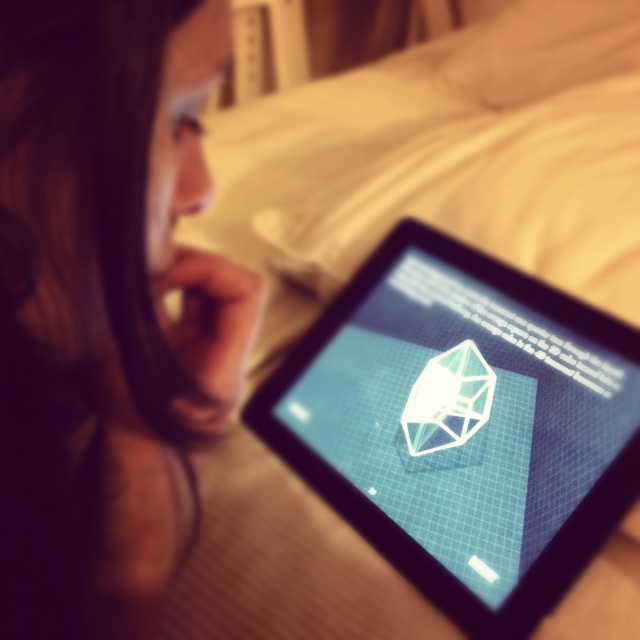
Question: Can you confirm if brown hair at upper left is bigger than transparent glass tablet at center?

Choices:
 (A) yes
 (B) no

Answer: (B)

Question: Which object appears closest to the camera in this image?

Choices:
 (A) transparent glass tablet at center
 (B) brown hair at upper left

Answer: (B)

Question: Does brown hair at upper left lie behind transparent glass tablet at center?

Choices:
 (A) no
 (B) yes

Answer: (A)

Question: Among these objects, which one is nearest to the camera?

Choices:
 (A) brown hair at upper left
 (B) transparent glass tablet at center

Answer: (A)

Question: Is brown hair at upper left positioned before transparent glass tablet at center?

Choices:
 (A) no
 (B) yes

Answer: (B)

Question: Among these points, which one is nearest to the camera?

Choices:
 (A) (314, 467)
 (B) (13, 600)

Answer: (B)